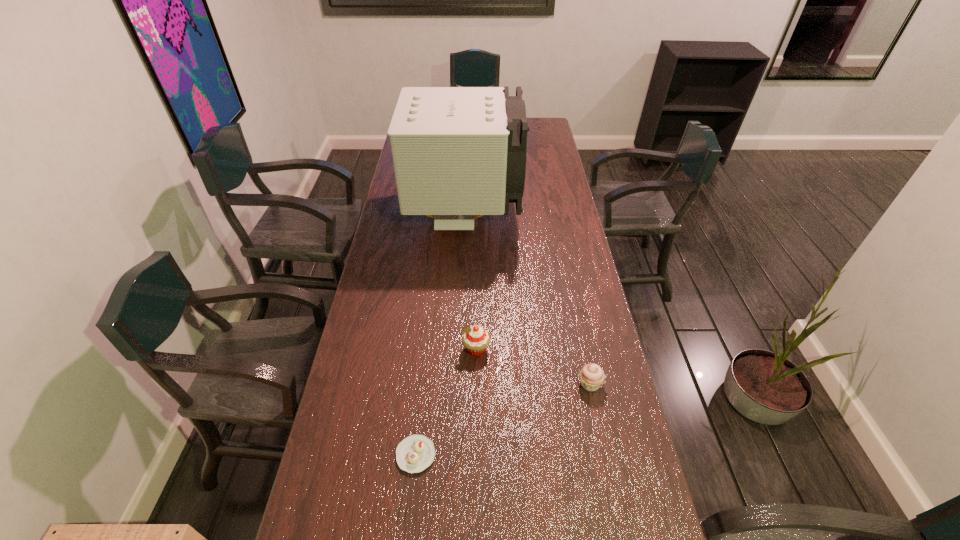
At what (x,y) coordinates should I click in order to perform the action: click on vacant area that lies between the tallest object and the leftmost cupcake. Please return your answer as a coordinate pair (x, y). The height and width of the screenshot is (540, 960). Looking at the image, I should click on (441, 335).

Where is `vacant space that is in between the farthest cupcake and the shortest cupcake`? Image resolution: width=960 pixels, height=540 pixels. vacant space that is in between the farthest cupcake and the shortest cupcake is located at coordinates pyautogui.click(x=446, y=402).

The width and height of the screenshot is (960, 540). In order to click on vacant space in between the shortest object and the tallest object in this screenshot , I will do `click(441, 335)`.

The image size is (960, 540). Identify the location of unoccupied position between the rightmost cupcake and the leftmost cupcake. (503, 420).

Where is `vacant space in between the second cupcake from left to right and the fan`? vacant space in between the second cupcake from left to right and the fan is located at coordinates point(470,282).

This screenshot has width=960, height=540. Find the location of `vacant space that is in between the tallest object and the second tallest cupcake`. vacant space that is in between the tallest object and the second tallest cupcake is located at coordinates (527, 300).

The image size is (960, 540). Find the location of `the closest object to the farthest object`. the closest object to the farthest object is located at coordinates (x=475, y=339).

At what (x,y) coordinates should I click in order to perform the action: click on object that is the second closest one to the third shortest object. Please return your answer as a coordinate pair (x, y). The image size is (960, 540). Looking at the image, I should click on (591, 376).

The width and height of the screenshot is (960, 540). What are the coordinates of `the second closest cupcake to the farthest cupcake` in the screenshot? It's located at (591, 376).

Choose which cupcake is the second nearest neighbor to the tallest object. Please provide its 2D coordinates. Your answer should be formatted as a tuple, i.e. [(x, y)], where the tuple contains the x and y coordinates of a point satisfying the conditions above.

[(591, 376)]